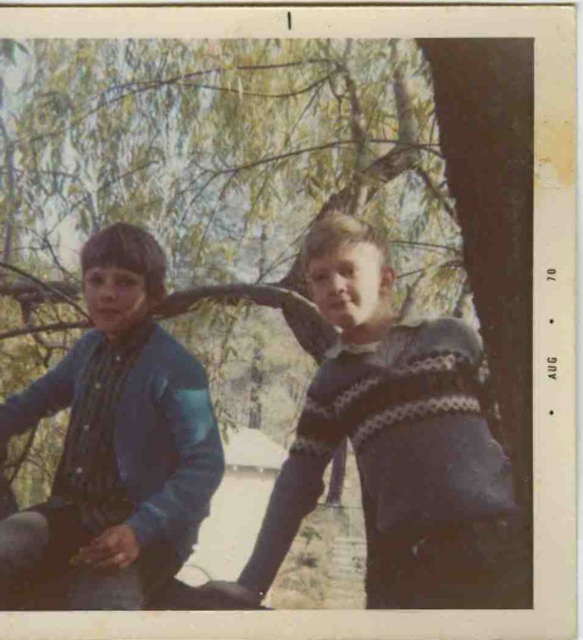
Image resolution: width=583 pixels, height=640 pixels. Describe the element at coordinates (219, 161) in the screenshot. I see `green leafy tree at upper center` at that location.

Who is more distant from viewer, (96,51) or (163,476)?

Positioned behind is point (96,51).

Where is `green leafy tree at upper center`? The width and height of the screenshot is (583, 640). green leafy tree at upper center is located at coordinates (219, 161).

Between green leafy tree at upper center and knitted sweater at center, which one has more height?

green leafy tree at upper center

Can you confirm if green leafy tree at upper center is thinner than knitted sweater at center?

No, green leafy tree at upper center is not thinner than knitted sweater at center.

At what (x,y) coordinates should I click in order to perform the action: click on green leafy tree at upper center. Please return your answer as a coordinate pair (x, y). Image resolution: width=583 pixels, height=640 pixels. Looking at the image, I should click on (219, 161).

Where is `green leafy tree at upper center`? The width and height of the screenshot is (583, 640). green leafy tree at upper center is located at coordinates (219, 161).

What do you see at coordinates (395, 444) in the screenshot? This screenshot has width=583, height=640. I see `knitted sweater at center` at bounding box center [395, 444].

Is point (494, 538) closer to viewer compared to point (100, 369)?

Yes, point (494, 538) is in front of point (100, 369).

This screenshot has width=583, height=640. I want to click on knitted sweater at center, so click(395, 444).